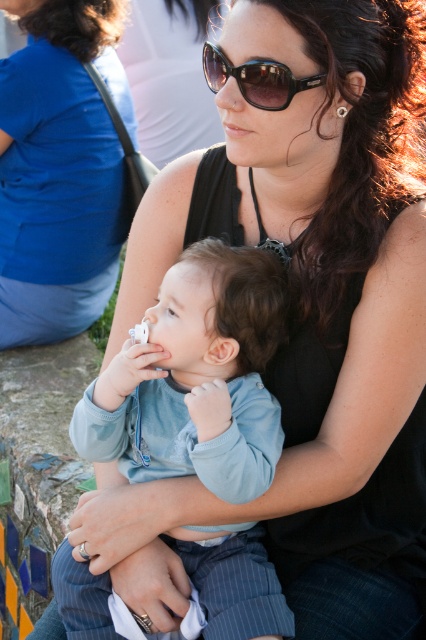
Between point (43, 161) and point (204, 72), which one is positioned behind?

Positioned behind is point (43, 161).

At what (x,y) coordinates should I click in order to perform the action: click on matte black tank top at center. Please return your answer as a coordinate pair (x, y). The height and width of the screenshot is (640, 426). Looking at the image, I should click on (60, 170).

Where is `matte black tank top at center`? This screenshot has width=426, height=640. matte black tank top at center is located at coordinates (60, 170).

Does light blue fabric pacifier at center appear over matte black tank top at center?

No, light blue fabric pacifier at center is not above matte black tank top at center.

Which of these two, light blue fabric pacifier at center or matte black tank top at center, stands taller?

Standing taller between the two is matte black tank top at center.

Between point (178, 284) and point (42, 244), which one is positioned in front?

Point (178, 284) is in front.

The height and width of the screenshot is (640, 426). I want to click on light blue fabric pacifier at center, so click(195, 378).

Is light blue fabric pacifier at center to the left of brown glossy sunglasses at upper center from the viewer's perspective?

Correct, you'll find light blue fabric pacifier at center to the left of brown glossy sunglasses at upper center.

Is light blue fabric pacifier at center thinner than brown glossy sunglasses at upper center?

No.

Where is `light blue fabric pacifier at center`? light blue fabric pacifier at center is located at coordinates (195, 378).